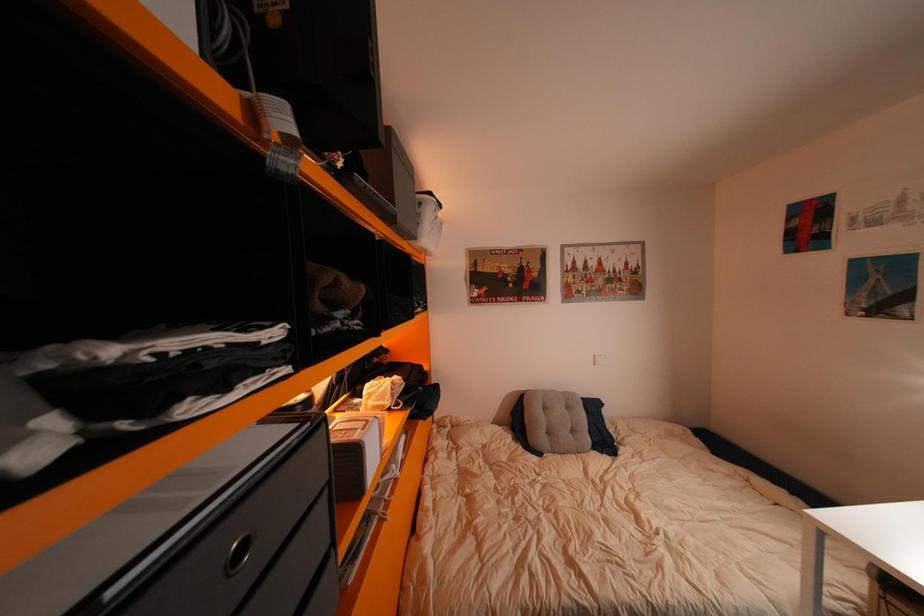
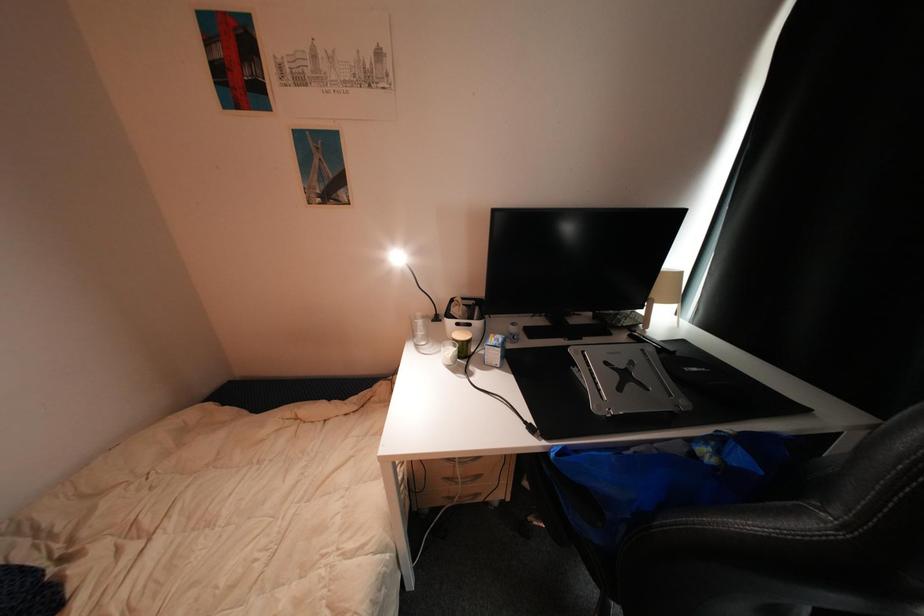
Based on the continuous images, in which direction is the camera rotating?

The camera rotated toward right-down.